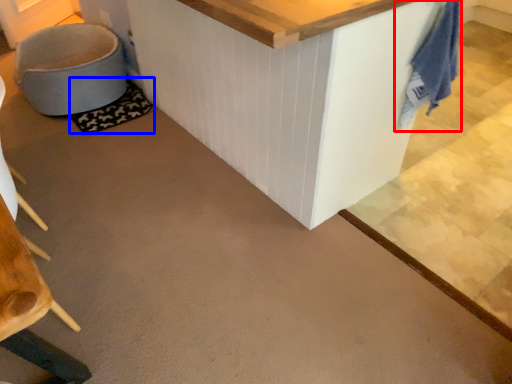
Question: Which of the following is the farthest to the observer, laundry (highlighted by a red box) or mat (highlighted by a blue box)?

Choices:
 (A) laundry
 (B) mat

Answer: (B)